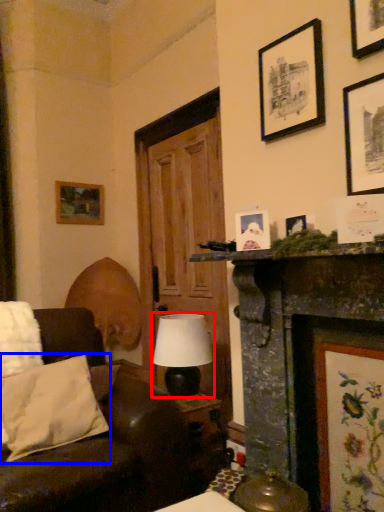
Question: Which object is closer to the camera taking this photo, table lamp (highlighted by a red box) or pillow (highlighted by a blue box)?

Choices:
 (A) table lamp
 (B) pillow

Answer: (B)